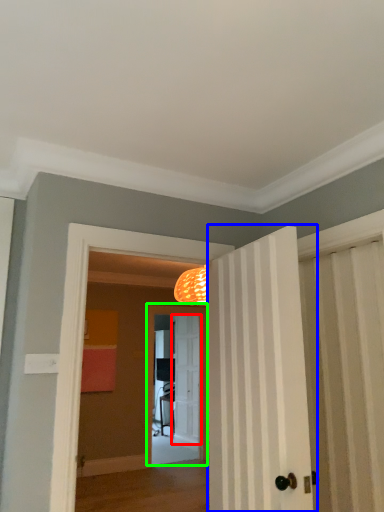
Question: Based on their relative distances, which object is farther from door (highlighted by a red box)? Choose from door (highlighted by a blue box) and screen door (highlighted by a green box).

Choices:
 (A) door
 (B) screen door

Answer: (A)